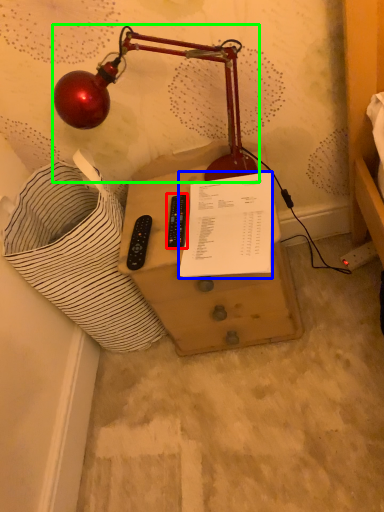
Question: Considering the real-world distances, which object is farthest from control (highlighted by a red box)? document (highlighted by a blue box) or lamp (highlighted by a green box)?

Choices:
 (A) document
 (B) lamp

Answer: (B)